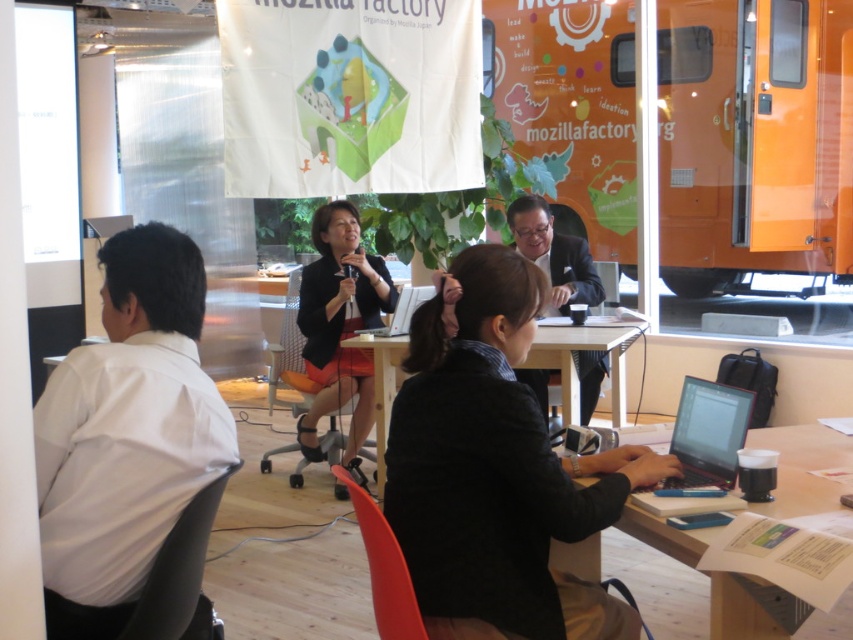
You are organizing a photoshoot and need to ensure that all clothing items in the scene are appropriately sized for the models. Given the black fabric jacket at center and the dark suit at center, which clothing item would require a larger model to wear it comfortably?

The black fabric jacket at center is larger in size than the dark suit at center, so it would require a larger model to wear it comfortably.

You are a service robot in a workshop. You need to deliver a document to the person wearing the black matte blazer at center. The document is on the black glossy laptop at lower right. Can you hand it to them directly without moving the laptop?

The distance between the black matte blazer at center and the black glossy laptop at lower right is 8.22 feet. Since the laptop is 8.22 feet away from the person, you cannot reach it directly without moving either the laptop or the person.

You are organizing a small presentation in this room and need to place a 1.2 meter wide screen between the white glossy table at center and the silver metallic laptop at center. Considering their sizes, will the screen fit between them?

The white glossy table at center is larger in size than the silver metallic laptop at center, but the description does not provide exact dimensions for either object or the space between them. Therefore, it is unclear if the 1.2 meter wide screen will fit between them based on the given information.